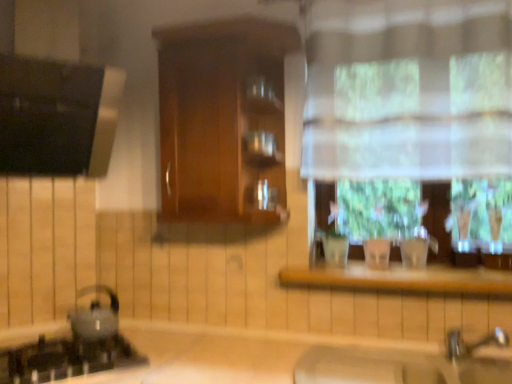
Question: Do you think black glass gas stove at lower left is within wooden at center, or outside of it?

Choices:
 (A) inside
 (B) outside

Answer: (B)

Question: Does point click(x=13, y=367) appear closer or farther from the camera than point click(x=354, y=263)?

Choices:
 (A) farther
 (B) closer

Answer: (B)

Question: Which object is positioned closest to the wooden cabinet at center?

Choices:
 (A) shiny metallic kettle at lower left
 (B) wooden at center
 (C) beige matte sink at lower center
 (D) white sheer curtain at upper right
 (E) black glass gas stove at lower left

Answer: (D)

Question: Based on their relative distances, which object is farther from the black glass gas stove at lower left?

Choices:
 (A) beige matte sink at lower center
 (B) wooden cabinet at center
 (C) wooden at center
 (D) white sheer curtain at upper right
 (E) shiny metallic kettle at lower left

Answer: (D)